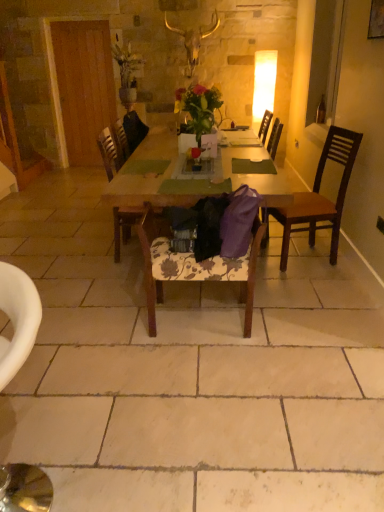
You are a GUI agent. You are given a task and a screenshot of the screen. Output one action in this format:
    pyautogui.click(x=<x>, y=<y>)
    Task: Click on the vacant location below floral fabric chair at center, arranged as the third chair when viewed from the left (from a real-world perspective)
    This screenshot has height=512, width=384.
    Given the screenshot: What is the action you would take?
    pyautogui.click(x=196, y=320)